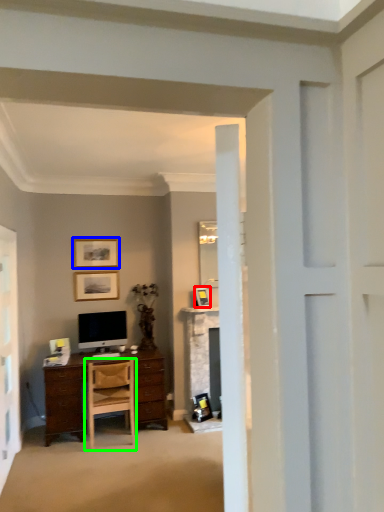
Question: Considering the real-world distances, which object is farthest from picture frame (highlighted by a red box)? picture frame (highlighted by a blue box) or chair (highlighted by a green box)?

Choices:
 (A) picture frame
 (B) chair

Answer: (B)